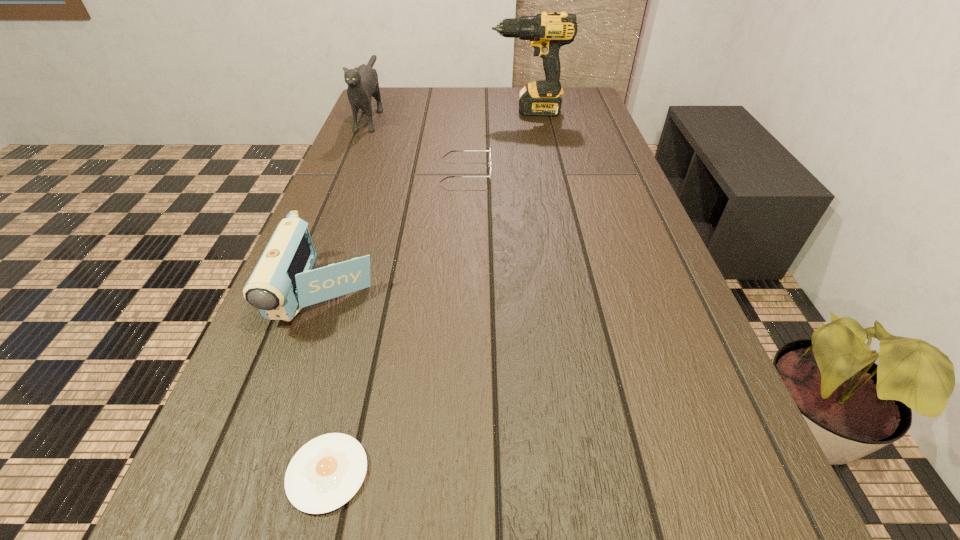
You are a GUI agent. You are given a task and a screenshot of the screen. Output one action in this format:
    pyautogui.click(x=<x>, y=<y>)
    Task: Click on the blank space that satisfies the following two spatial constraints: 1. at the tip of the drill; 2. on the side of the fourth farthest object with the flip-out screen
    
    Given the screenshot: What is the action you would take?
    pyautogui.click(x=562, y=293)